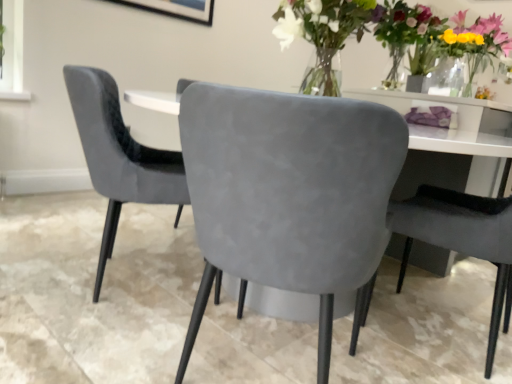
Question: In the image, is suede gray chair at center, which ranks as the first chair in right-to-left order, positioned in front of or behind velvet grey chair at center, which is the third chair from right to left?

Choices:
 (A) behind
 (B) front

Answer: (B)

Question: Considering the positions of point (458, 240) and point (165, 165), is point (458, 240) closer or farther from the camera than point (165, 165)?

Choices:
 (A) closer
 (B) farther

Answer: (A)

Question: Based on their relative distances, which object is farther from the suede gray chair at center, marked as the third chair in a left-to-right arrangement?

Choices:
 (A) suede gray chair at center, which appears as the second chair when viewed from the right
 (B) velvet grey chair at center, placed as the first chair when sorted from left to right
 (C) matte glass vase at upper right

Answer: (C)

Question: Considering the real-world distances, which object is farthest from the matte glass vase at upper right?

Choices:
 (A) velvet grey chair at center, placed as the first chair when sorted from left to right
 (B) suede gray chair at center, which appears as the second chair when viewed from the right
 (C) suede gray chair at center, which ranks as the first chair in right-to-left order

Answer: (B)